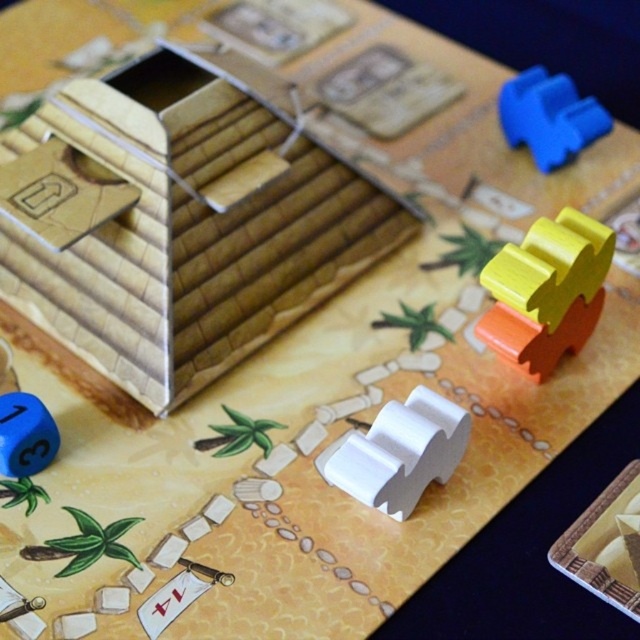
Who is more distant from viewer, (108, 204) or (506, 83)?

Point (506, 83)

Can you confirm if wooden pyramid at center is bigger than blue rubber block at upper right?

Yes, wooden pyramid at center is bigger than blue rubber block at upper right.

Where is `wooden pyramid at center`? Image resolution: width=640 pixels, height=640 pixels. wooden pyramid at center is located at coordinates (180, 220).

Who is higher up, yellow matte wooden piece at upper right or blue rubber block at upper right?

Positioned higher is blue rubber block at upper right.

Can you confirm if yellow matte wooden piece at upper right is positioned below blue rubber block at upper right?

Correct, yellow matte wooden piece at upper right is located below blue rubber block at upper right.

Who is more distant from viewer, (529, 234) or (545, 80)?

Positioned behind is point (545, 80).

Locate an element on the screen. The height and width of the screenshot is (640, 640). yellow matte wooden piece at upper right is located at coordinates (547, 291).

Which is more to the right, white plastic staircase at center or blue matte die at lower left?

white plastic staircase at center

Is white plastic staircase at center positioned in front of blue matte die at lower left?

Yes.

Find the location of a particular element. The width and height of the screenshot is (640, 640). white plastic staircase at center is located at coordinates (401, 452).